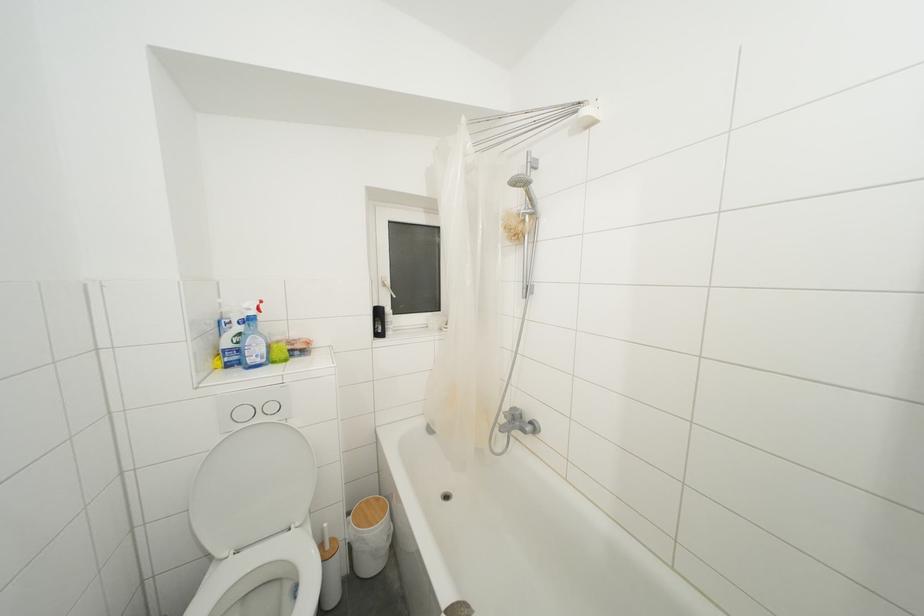
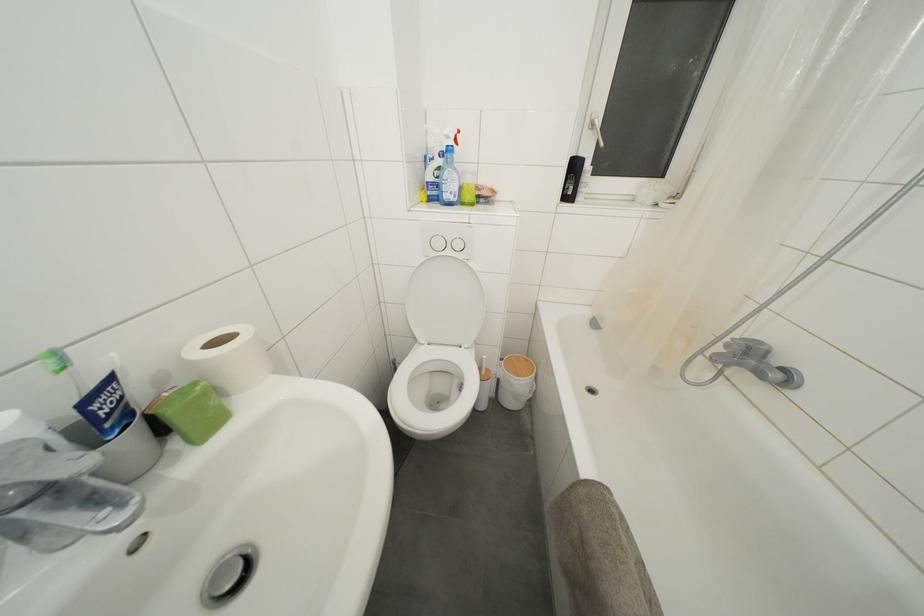
Find the pixel in the second image that matches pixel 371 506 in the first image.

(521, 362)